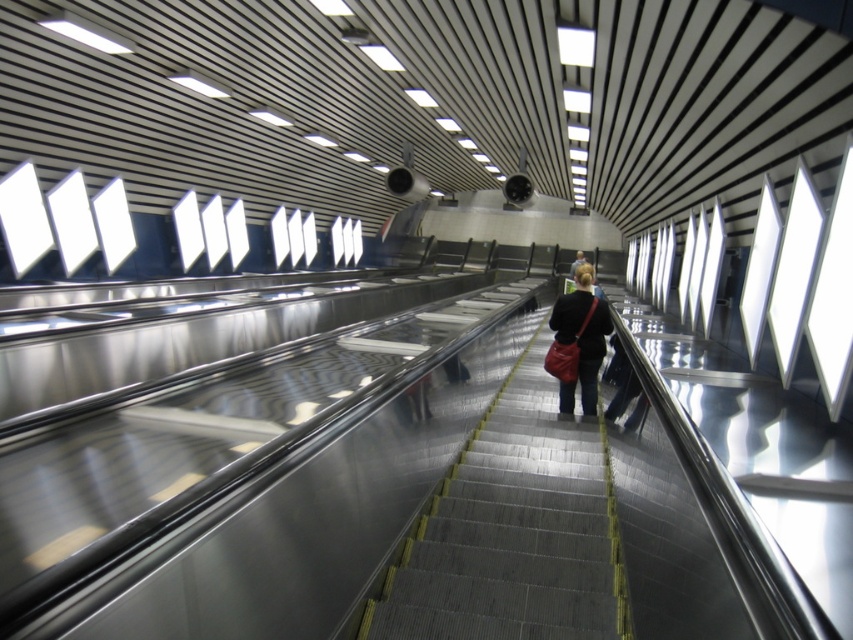
Between metallic gray stairs at center and dark blue jeans at center, which one appears on the right side from the viewer's perspective?

Positioned to the right is dark blue jeans at center.

Which is in front, point (619, 580) or point (582, 260)?

Point (619, 580) is more forward.

At what (x,y) coordinates should I click in order to perform the action: click on metallic gray stairs at center. Please return your answer as a coordinate pair (x, y). The image size is (853, 640). Looking at the image, I should click on (511, 531).

Where is `metallic gray stairs at center`? The image size is (853, 640). metallic gray stairs at center is located at coordinates (511, 531).

Does metallic gray stairs at center appear over black leather jacket at center?

Incorrect, metallic gray stairs at center is not positioned above black leather jacket at center.

Between point (498, 556) and point (599, 332), which one is positioned in front?

Positioned in front is point (498, 556).

Locate an element on the screen. The height and width of the screenshot is (640, 853). metallic gray stairs at center is located at coordinates (511, 531).

Is black leather jacket at center positioned behind dark blue jeans at center?

No, it is not.

Looking at this image, does black leather jacket at center appear under dark blue jeans at center?

Indeed, black leather jacket at center is positioned under dark blue jeans at center.

Locate an element on the screen. The width and height of the screenshot is (853, 640). black leather jacket at center is located at coordinates (578, 342).

Identify the location of black leather jacket at center. This screenshot has width=853, height=640. (578, 342).